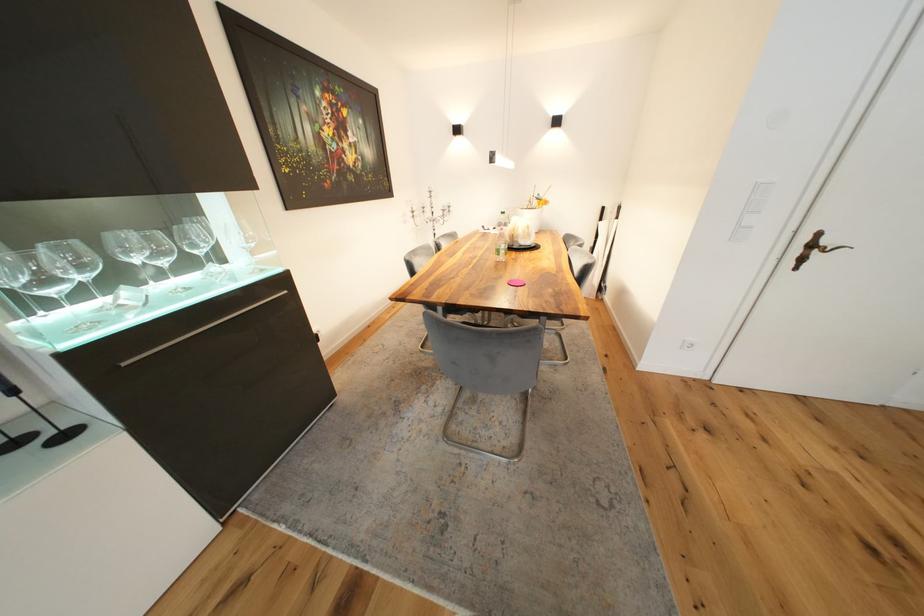
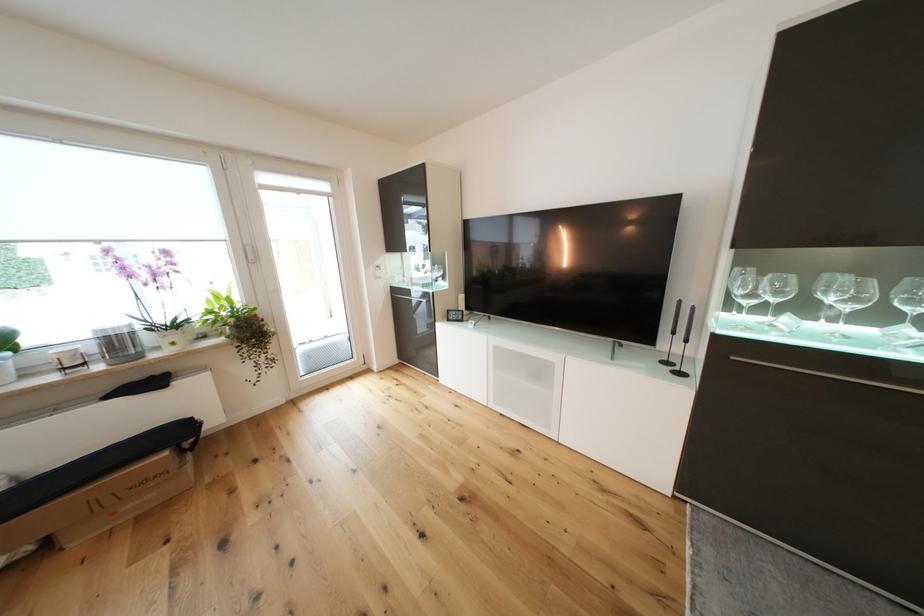
Locate, in the second image, the point that corresponds to point (88, 269) in the first image.

(784, 294)